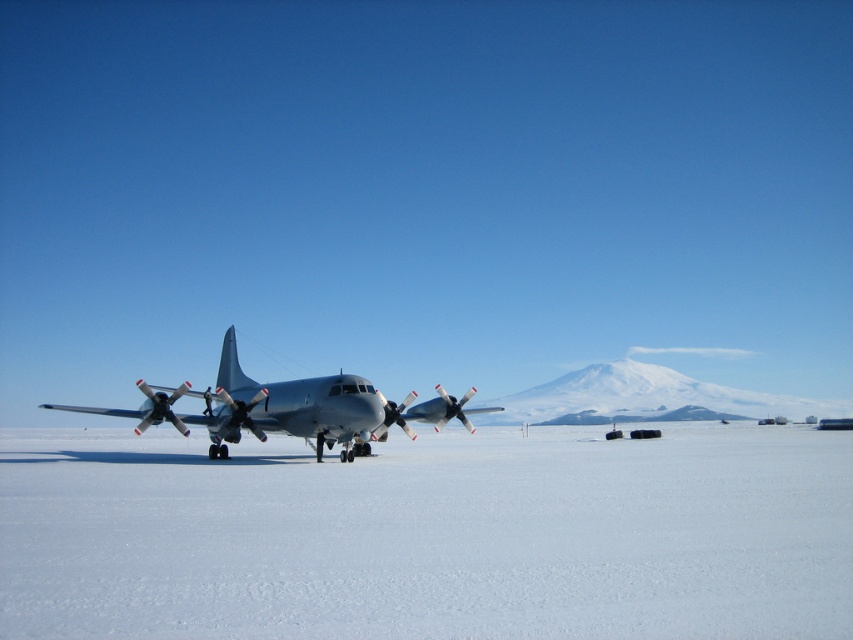
Question: Can you confirm if white smooth snow at center is positioned to the left of metallic gray airplane at center?

Choices:
 (A) no
 (B) yes

Answer: (A)

Question: Can you confirm if white smooth snow at center is positioned above metallic gray airplane at center?

Choices:
 (A) yes
 (B) no

Answer: (A)

Question: Which point is farther to the camera?

Choices:
 (A) (28, 513)
 (B) (383, 417)

Answer: (B)

Question: Among these points, which one is farthest from the camera?

Choices:
 (A) (821, 600)
 (B) (370, 406)

Answer: (B)

Question: Is white smooth snow at center thinner than metallic gray airplane at center?

Choices:
 (A) no
 (B) yes

Answer: (A)

Question: Which point is farther from the camera taking this photo?

Choices:
 (A) (27, 492)
 (B) (294, 426)

Answer: (B)